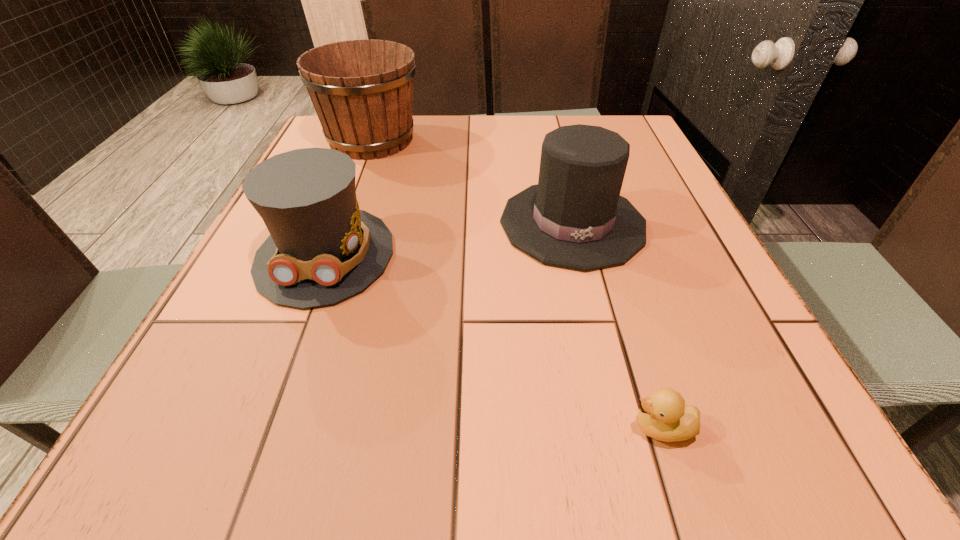
Image resolution: width=960 pixels, height=540 pixels. I want to click on vacant region located 0.180m on the face of the shortest object, so click(501, 428).

Identify the location of object that is at the far edge. Image resolution: width=960 pixels, height=540 pixels. (362, 90).

Where is `object at the near edge`? The width and height of the screenshot is (960, 540). object at the near edge is located at coordinates (663, 416).

This screenshot has height=540, width=960. I want to click on wine bucket that is at the left edge, so click(x=362, y=90).

This screenshot has height=540, width=960. Identify the location of dress hat present at the left edge. (322, 249).

Locate an element on the screen. The height and width of the screenshot is (540, 960). dress hat present at the right edge is located at coordinates (575, 218).

Identify the location of duckling that is at the right edge. (663, 416).

At what (x,y) coordinates should I click in order to perform the action: click on object positioned at the far left corner. Please return your answer as a coordinate pair (x, y). Image resolution: width=960 pixels, height=540 pixels. Looking at the image, I should click on (362, 90).

At what (x,y) coordinates should I click in order to perform the action: click on object that is at the near right corner. Please return your answer as a coordinate pair (x, y). The width and height of the screenshot is (960, 540). Looking at the image, I should click on (663, 416).

You are a GUI agent. You are given a task and a screenshot of the screen. Output one action in this format:
    pyautogui.click(x=<x>, y=<y>)
    Task: Click on the vacant space at the far edge of the desktop
    Image resolution: width=960 pixels, height=540 pixels.
    Given the screenshot: What is the action you would take?
    pyautogui.click(x=447, y=119)